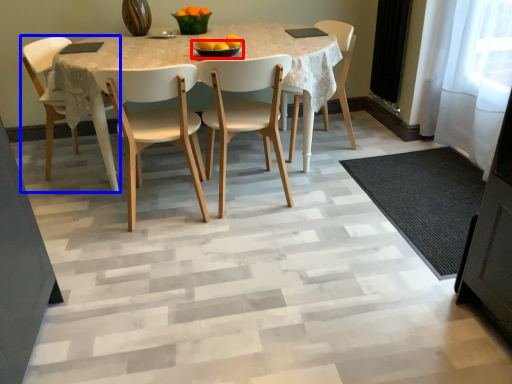
Question: Which of the following is the farthest to the observer, bowl (highlighted by a red box) or chair (highlighted by a blue box)?

Choices:
 (A) bowl
 (B) chair

Answer: (B)